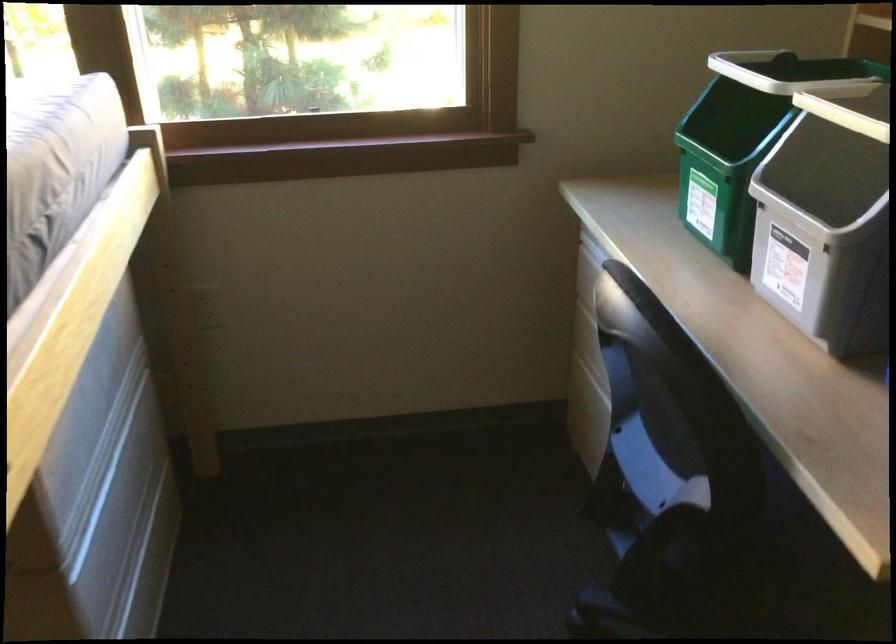
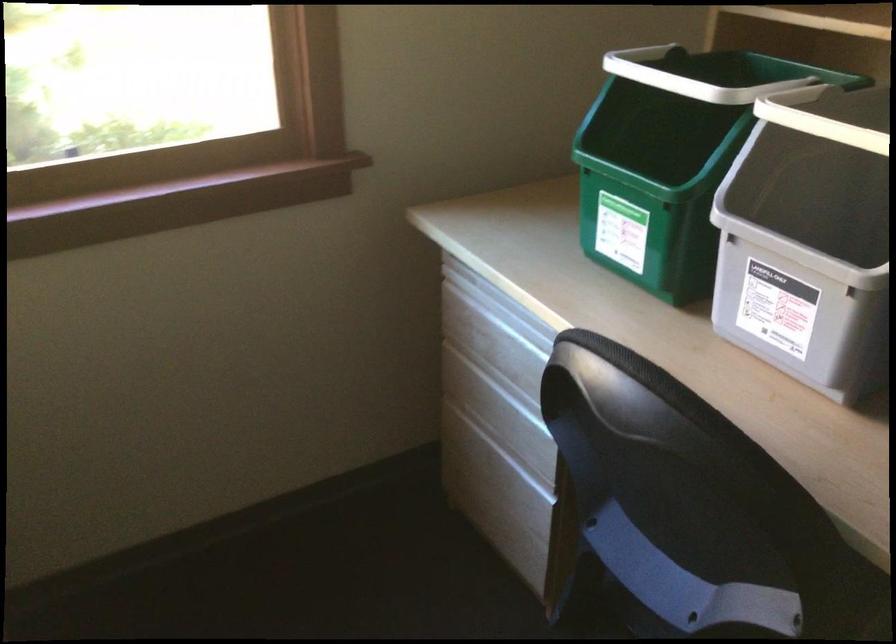
Question: The camera is either moving clockwise (left) or counter-clockwise (right) around the object. The first image is from the beginning of the video and the second image is from the end. Is the camera moving left or right when shooting the video?

Choices:
 (A) Left
 (B) Right

Answer: (A)